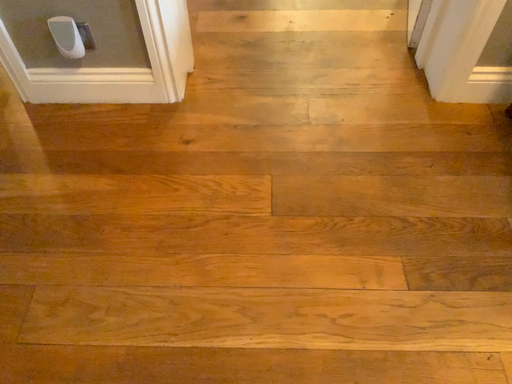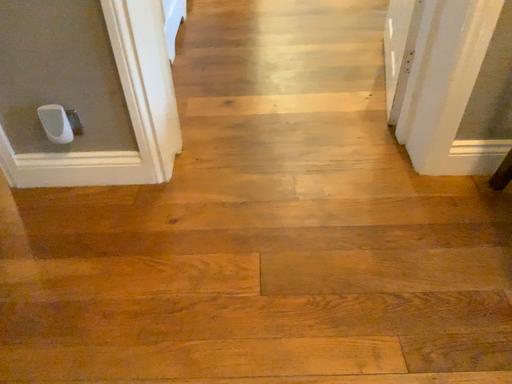
Question: How did the camera likely rotate when shooting the video?

Choices:
 (A) rotated upward
 (B) rotated downward

Answer: (A)